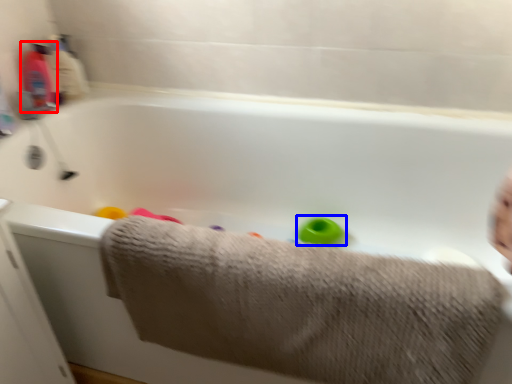
Question: Which object appears closest to the camera in this image, baby bottle (highlighted by a red box) or toy (highlighted by a blue box)?

Choices:
 (A) baby bottle
 (B) toy

Answer: (A)